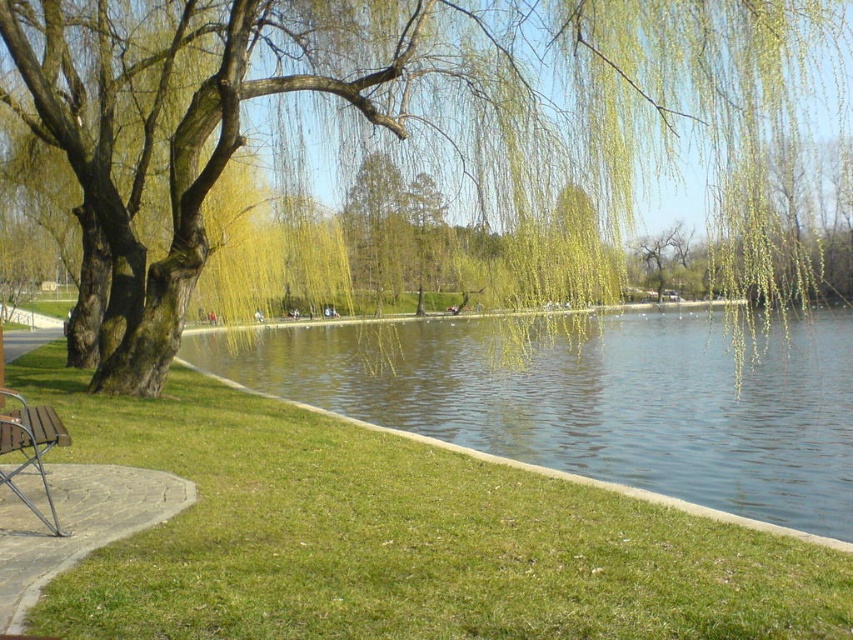
Question: Which point is closer to the camera?

Choices:
 (A) (126, 4)
 (B) (16, 445)
 (C) (747, 401)

Answer: (B)

Question: Can you confirm if green leafy willow at upper center is positioned below wooden bench at lower left?

Choices:
 (A) yes
 (B) no

Answer: (B)

Question: Is green leafy willow at upper center further to camera compared to wooden bench at lower left?

Choices:
 (A) no
 (B) yes

Answer: (B)

Question: Is green leafy willow at upper center wider than green liquid water at center?

Choices:
 (A) yes
 (B) no

Answer: (B)

Question: Which object is the closest to the green leafy willow at upper center?

Choices:
 (A) wooden bench at lower left
 (B) green liquid water at center

Answer: (B)

Question: Which object appears closest to the camera in this image?

Choices:
 (A) green liquid water at center
 (B) green leafy willow at upper center

Answer: (A)